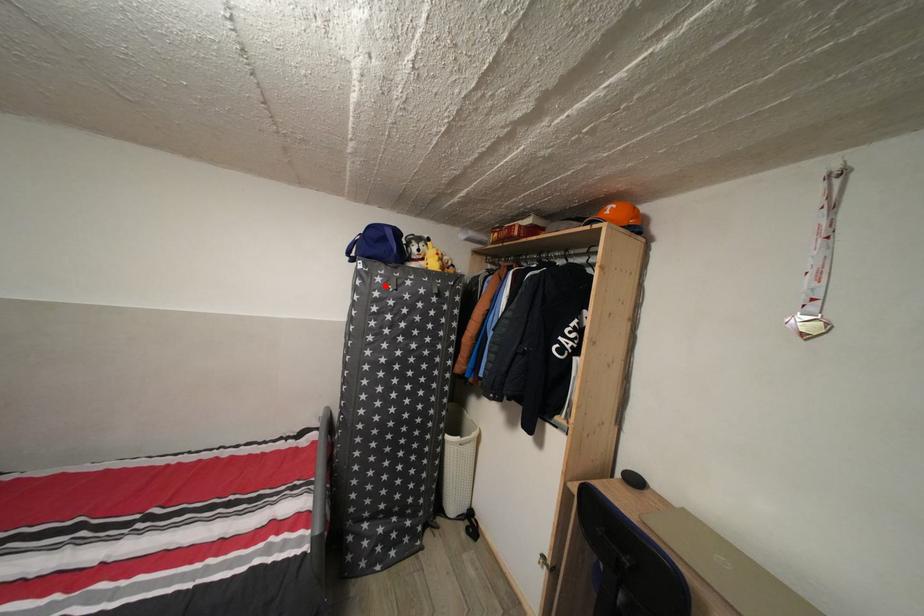
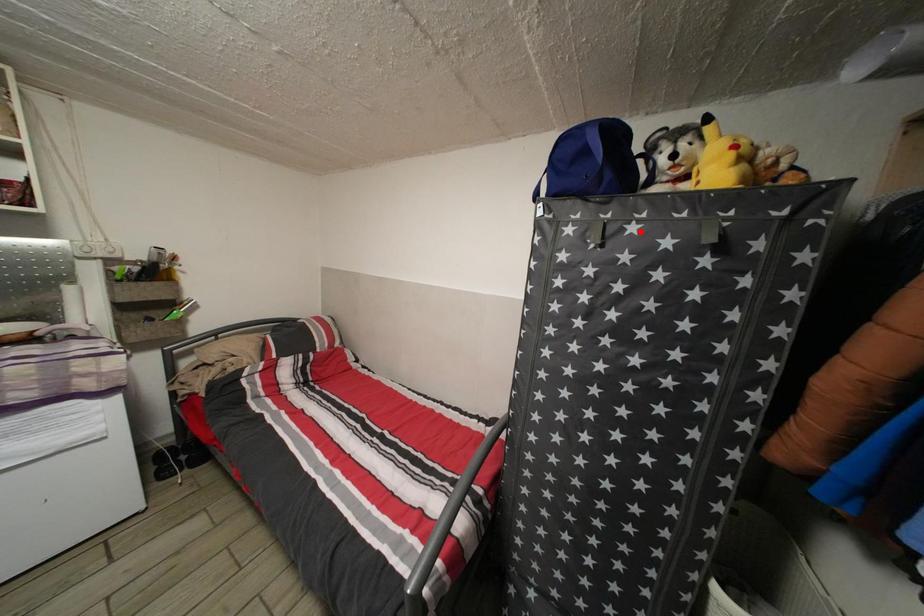
I am providing you with two images of the same scene from different viewpoints. A red point is marked on the first image and another point is marked on the second image. Are the points marked in image1 and image2 representing the same 3D position?

No